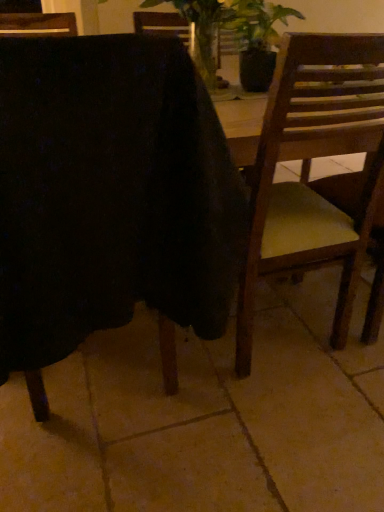
The width and height of the screenshot is (384, 512). Describe the element at coordinates (309, 166) in the screenshot. I see `wooden chair at right, which appears as the second chair when viewed from the left` at that location.

Locate an element on the screen. wooden chair at right, which appears as the 1th chair when viewed from the right is located at coordinates (309, 166).

This screenshot has width=384, height=512. What are the coordinates of `wooden chair at center, the 2th chair when ordered from right to left` in the screenshot? It's located at (110, 194).

The height and width of the screenshot is (512, 384). Describe the element at coordinates (110, 194) in the screenshot. I see `wooden chair at center, the 2th chair when ordered from right to left` at that location.

Where is `wooden chair at right, which appears as the second chair when viewed from the left`? This screenshot has height=512, width=384. wooden chair at right, which appears as the second chair when viewed from the left is located at coordinates (309, 166).

Which is more to the right, wooden chair at center, the 1th chair from the left, or wooden chair at right, which appears as the second chair when viewed from the left?

Positioned to the right is wooden chair at right, which appears as the second chair when viewed from the left.

Considering the positions of objects wooden chair at center, the 1th chair from the left, and wooden chair at right, which appears as the 1th chair when viewed from the right, in the image provided, who is behind, wooden chair at center, the 1th chair from the left, or wooden chair at right, which appears as the 1th chair when viewed from the right,?

wooden chair at right, which appears as the 1th chair when viewed from the right, is further from the camera.

Is point (34, 337) less distant than point (280, 195)?

Yes, point (34, 337) is in front of point (280, 195).

Based on the photo, from the image's perspective, between wooden chair at center, the 1th chair from the left, and wooden chair at right, which appears as the 1th chair when viewed from the right, who is located below?

wooden chair at right, which appears as the 1th chair when viewed from the right, appears lower in the image.

From a real-world perspective, which is physically below, wooden chair at center, the 2th chair when ordered from right to left, or wooden chair at right, which appears as the second chair when viewed from the left?

In real-world perspective, wooden chair at right, which appears as the second chair when viewed from the left, is lower.

Considering the sizes of objects wooden chair at center, the 2th chair when ordered from right to left, and wooden chair at right, which appears as the second chair when viewed from the left, in the image provided, who is thinner, wooden chair at center, the 2th chair when ordered from right to left, or wooden chair at right, which appears as the second chair when viewed from the left,?

wooden chair at right, which appears as the second chair when viewed from the left.

Between wooden chair at center, the 2th chair when ordered from right to left, and wooden chair at right, which appears as the 1th chair when viewed from the right, which one has more height?

With more height is wooden chair at right, which appears as the 1th chair when viewed from the right.

Based on their sizes in the image, would you say wooden chair at center, the 2th chair when ordered from right to left, is bigger or smaller than wooden chair at right, which appears as the second chair when viewed from the left?

Clearly, wooden chair at center, the 2th chair when ordered from right to left, is larger in size than wooden chair at right, which appears as the second chair when viewed from the left.

Which is correct: wooden chair at center, the 2th chair when ordered from right to left, is inside wooden chair at right, which appears as the 1th chair when viewed from the right, or outside of it?

wooden chair at center, the 2th chair when ordered from right to left, is not enclosed by wooden chair at right, which appears as the 1th chair when viewed from the right.

Is wooden chair at center, the 1th chair from the left, in contact with wooden chair at right, which appears as the second chair when viewed from the left?

No, wooden chair at center, the 1th chair from the left, is not next to wooden chair at right, which appears as the second chair when viewed from the left.

Is wooden chair at center, the 2th chair when ordered from right to left, oriented towards wooden chair at right, which appears as the 1th chair when viewed from the right?

No, wooden chair at center, the 2th chair when ordered from right to left, is not aimed at wooden chair at right, which appears as the 1th chair when viewed from the right.

How different are the orientations of wooden chair at center, the 2th chair when ordered from right to left, and wooden chair at right, which appears as the second chair when viewed from the left, in degrees?

The angle between the facing direction of wooden chair at center, the 2th chair when ordered from right to left, and the facing direction of wooden chair at right, which appears as the second chair when viewed from the left, is 1.77 degrees.

At what (x,y) coordinates should I click in order to perform the action: click on chair behind the wooden chair at center, the 2th chair when ordered from right to left. Please return your answer as a coordinate pair (x, y). The width and height of the screenshot is (384, 512). Looking at the image, I should click on tap(309, 166).

Considering the relative positions of wooden chair at right, which appears as the 1th chair when viewed from the right, and wooden chair at center, the 1th chair from the left, in the image provided, is wooden chair at right, which appears as the 1th chair when viewed from the right, to the right of wooden chair at center, the 1th chair from the left, from the viewer's perspective?

Yes, wooden chair at right, which appears as the 1th chair when viewed from the right, is to the right of wooden chair at center, the 1th chair from the left.

Which object is further away from the camera, wooden chair at right, which appears as the second chair when viewed from the left, or wooden chair at center, the 2th chair when ordered from right to left?

Positioned behind is wooden chair at right, which appears as the second chair when viewed from the left.

Which point is more distant from viewer, (x=347, y=98) or (x=4, y=358)?

The point (x=4, y=358) is more distant.

From the image's perspective, is wooden chair at right, which appears as the 1th chair when viewed from the right, positioned above or below wooden chair at center, the 1th chair from the left?

From the image's perspective, wooden chair at right, which appears as the 1th chair when viewed from the right, appears below wooden chair at center, the 1th chair from the left.

From a real-world perspective, is wooden chair at right, which appears as the second chair when viewed from the left, positioned above or below wooden chair at center, the 1th chair from the left?

In terms of real-world spatial position, wooden chair at right, which appears as the second chair when viewed from the left, is below wooden chair at center, the 1th chair from the left.

Considering the relative sizes of wooden chair at right, which appears as the second chair when viewed from the left, and wooden chair at center, the 1th chair from the left, in the image provided, is wooden chair at right, which appears as the second chair when viewed from the left, wider than wooden chair at center, the 1th chair from the left,?

No.

Does wooden chair at right, which appears as the 1th chair when viewed from the right, have a lesser height compared to wooden chair at center, the 2th chair when ordered from right to left?

No.

Is wooden chair at right, which appears as the 1th chair when viewed from the right, bigger or smaller than wooden chair at center, the 1th chair from the left?

Considering their sizes, wooden chair at right, which appears as the 1th chair when viewed from the right, takes up less space than wooden chair at center, the 1th chair from the left.

Is wooden chair at center, the 2th chair when ordered from right to left, inside wooden chair at right, which appears as the 1th chair when viewed from the right?

No, wooden chair at center, the 2th chair when ordered from right to left, is not a part of wooden chair at right, which appears as the 1th chair when viewed from the right.

Is wooden chair at right, which appears as the 1th chair when viewed from the right, touching wooden chair at center, the 1th chair from the left?

No, wooden chair at right, which appears as the 1th chair when viewed from the right, is not with wooden chair at center, the 1th chair from the left.

Is wooden chair at right, which appears as the second chair when viewed from the left, oriented away from wooden chair at center, the 1th chair from the left?

No, wooden chair at right, which appears as the second chair when viewed from the left, is not facing the opposite direction of wooden chair at center, the 1th chair from the left.

How many degrees apart are the facing directions of wooden chair at right, which appears as the second chair when viewed from the left, and wooden chair at center, the 2th chair when ordered from right to left?

There is a 1.77-degree angle between the facing directions of wooden chair at right, which appears as the second chair when viewed from the left, and wooden chair at center, the 2th chair when ordered from right to left.

Measure the distance from wooden chair at right, which appears as the 1th chair when viewed from the right, to wooden chair at center, the 1th chair from the left.

A distance of 34.47 centimeters exists between wooden chair at right, which appears as the 1th chair when viewed from the right, and wooden chair at center, the 1th chair from the left.

At what (x,y) coordinates should I click in order to perform the action: click on chair that is below the wooden chair at center, the 2th chair when ordered from right to left (from the image's perspective). Please return your answer as a coordinate pair (x, y). Looking at the image, I should click on (309, 166).

Where is `chair lying on the right of wooden chair at center, the 1th chair from the left`? Image resolution: width=384 pixels, height=512 pixels. chair lying on the right of wooden chair at center, the 1th chair from the left is located at coordinates (309, 166).

This screenshot has width=384, height=512. In the image, there is a wooden chair at center, the 2th chair when ordered from right to left. In order to click on chair below it (from the image's perspective) in this screenshot , I will do `click(309, 166)`.